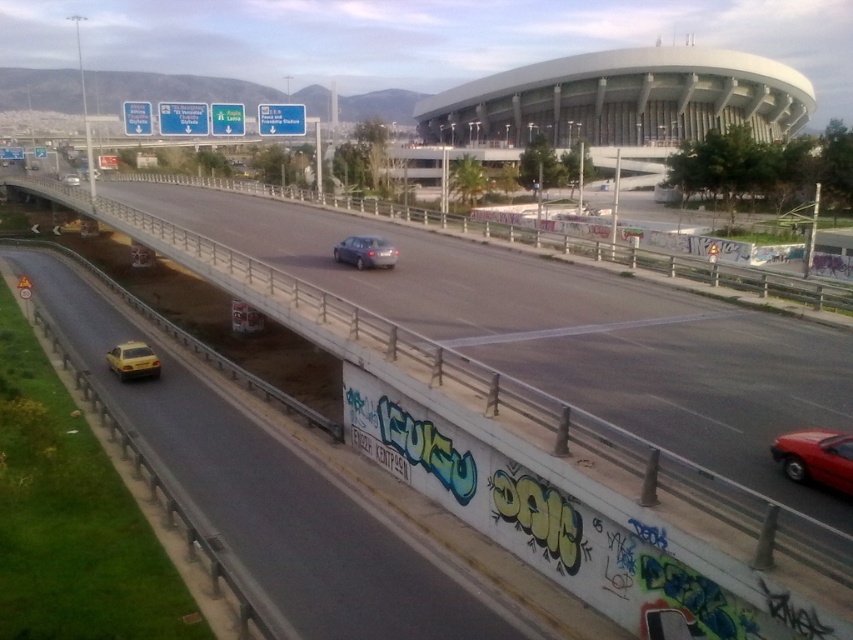
Question: Which is nearer to the satin silver sedan at center?

Choices:
 (A) yellow matte taxi at center
 (B) yellow matte taxi at lower left
 (C) shiny red sedan at lower right

Answer: (B)

Question: Which of these objects is positioned farthest from the satin silver sedan at center?

Choices:
 (A) white concrete stadium at upper center
 (B) shiny red sedan at lower right
 (C) yellow matte taxi at lower left
 (D) concrete highway at center

Answer: (A)

Question: Among these objects, which one is farthest from the camera?

Choices:
 (A) concrete highway at center
 (B) yellow matte taxi at center
 (C) yellow matte taxi at lower left
 (D) satin silver sedan at center

Answer: (B)

Question: Observing the image, what is the correct spatial positioning of concrete highway at center in reference to shiny red sedan at lower right?

Choices:
 (A) left
 (B) right

Answer: (A)

Question: Is shiny red sedan at lower right closer to the viewer compared to satin silver sedan at center?

Choices:
 (A) no
 (B) yes

Answer: (B)

Question: Is concrete highway at center to the right of satin silver sedan at center from the viewer's perspective?

Choices:
 (A) no
 (B) yes

Answer: (A)